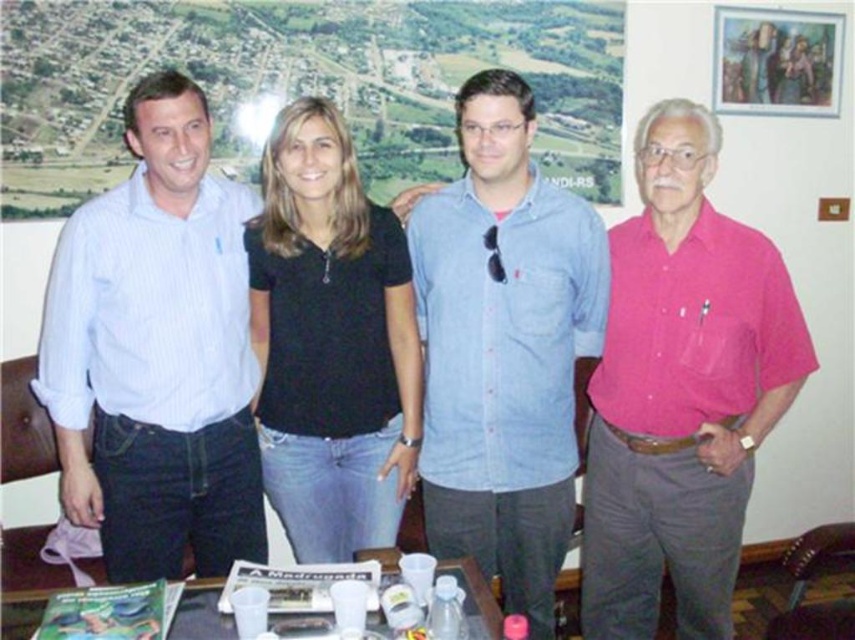
What do you see at coordinates (331, 342) in the screenshot? This screenshot has width=855, height=640. I see `black cotton shirt at center` at bounding box center [331, 342].

Find the location of a particular element. The image size is (855, 640). black cotton shirt at center is located at coordinates (331, 342).

Image resolution: width=855 pixels, height=640 pixels. Identify the location of black cotton shirt at center. (331, 342).

Is denim shirt at center smaller than translucent plastic cups at center?

Incorrect, denim shirt at center is not smaller in size than translucent plastic cups at center.

Can you confirm if denim shirt at center is shorter than translucent plastic cups at center?

In fact, denim shirt at center may be taller than translucent plastic cups at center.

Between point (429, 516) and point (481, 593), which one is positioned behind?

The point (429, 516) is more distant.

Locate an element on the screen. denim shirt at center is located at coordinates (503, 346).

How much distance is there between pink cotton shirt at right and denim shirt at center?

10.43 inches

Is pink cotton shirt at right wider than denim shirt at center?

In fact, pink cotton shirt at right might be narrower than denim shirt at center.

At what (x,y) coordinates should I click in order to perform the action: click on pink cotton shirt at right. Please return your answer as a coordinate pair (x, y). Looking at the image, I should click on (681, 390).

What are the coordinates of `pink cotton shirt at right` in the screenshot? It's located at (681, 390).